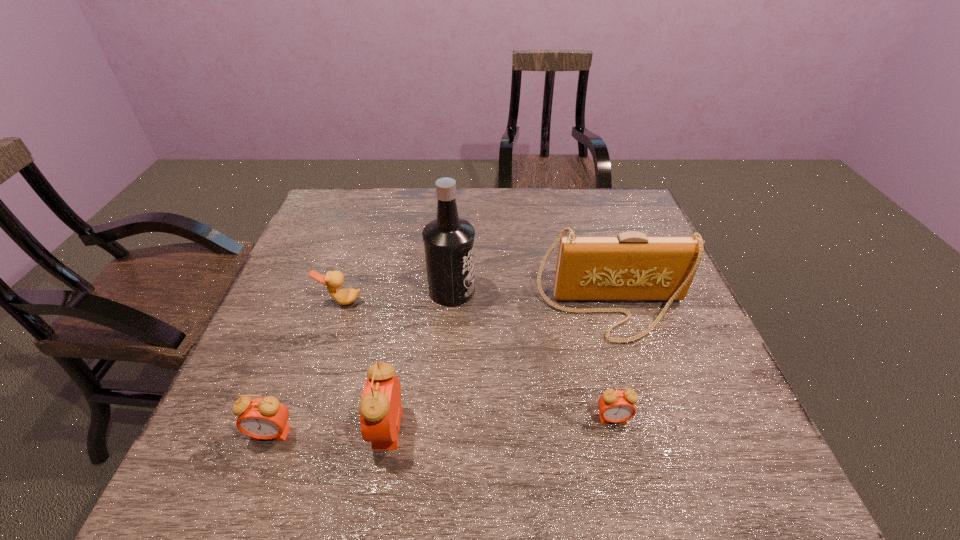
You are a GUI agent. You are given a task and a screenshot of the screen. Output one action in this format:
    pyautogui.click(x=<x>, y=<y>)
    Task: Click on the leftmost alarm clock
    The width and height of the screenshot is (960, 540).
    Given the screenshot: What is the action you would take?
    pyautogui.click(x=266, y=418)

This screenshot has height=540, width=960. Identify the location of the fourth tallest object. (266, 418).

This screenshot has width=960, height=540. Identify the location of the third object from left to right. (380, 409).

Find the location of a particular element. This screenshot has width=960, height=540. the second alarm clock from right to left is located at coordinates (380, 409).

Where is `the rightmost alarm clock`? Image resolution: width=960 pixels, height=540 pixels. the rightmost alarm clock is located at coordinates (615, 406).

The width and height of the screenshot is (960, 540). Identify the location of the tallest object. (449, 246).

In order to click on the third object from right to left in this screenshot , I will do `click(449, 246)`.

Where is `handbag`? handbag is located at coordinates (631, 266).

What are the coordinates of `duck` in the screenshot? It's located at (333, 279).

Image resolution: width=960 pixels, height=540 pixels. In order to click on free spot located on the face of the tallest alarm clock in this screenshot , I will do `click(244, 428)`.